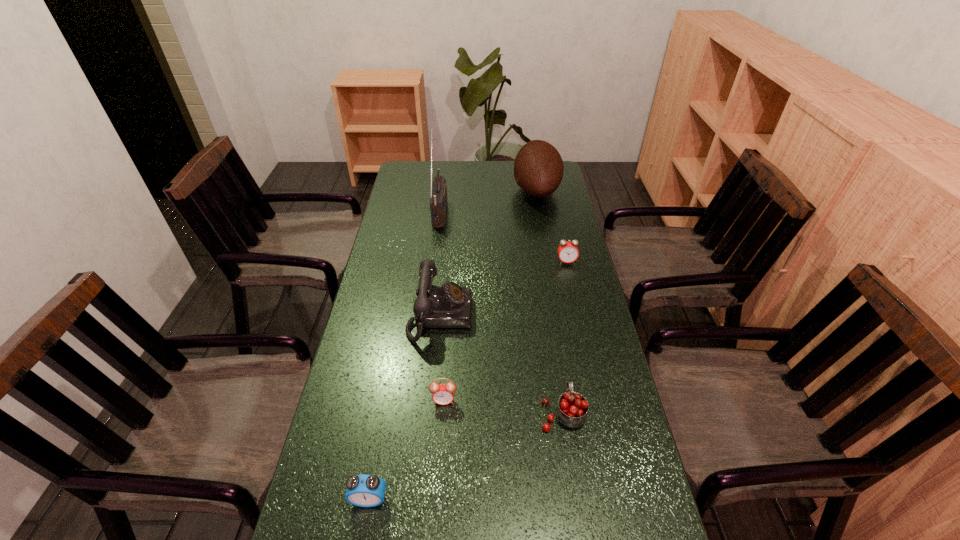
You are a GUI agent. You are given a task and a screenshot of the screen. Output one action in this format:
    pyautogui.click(x=<x>, y=<y>)
    Task: Click on the tallest object
    
    Given the screenshot: What is the action you would take?
    pos(438,202)

Locate an element on the screen. Image resolution: width=960 pixels, height=540 pixels. football is located at coordinates (538, 168).

The width and height of the screenshot is (960, 540). In order to click on the fourth farthest object in this screenshot , I will do `click(449, 306)`.

The image size is (960, 540). Find the location of `telephone`. telephone is located at coordinates (449, 306).

Identify the location of the fourth shortest object. This screenshot has height=540, width=960. (572, 408).

You are a GUI agent. You are given a task and a screenshot of the screen. Output one action in this format:
    pyautogui.click(x=<x>, y=<y>)
    Task: Click on the nearest alarm clock
    This screenshot has height=540, width=960.
    Given the screenshot: What is the action you would take?
    pyautogui.click(x=364, y=490)

I want to click on the nearest object, so click(x=364, y=490).

The height and width of the screenshot is (540, 960). I want to click on the third farthest object, so click(568, 252).

Locate an element on the screen. This screenshot has width=960, height=540. the rightmost alarm clock is located at coordinates (568, 252).

I want to click on the second alarm clock from right to left, so click(x=443, y=394).